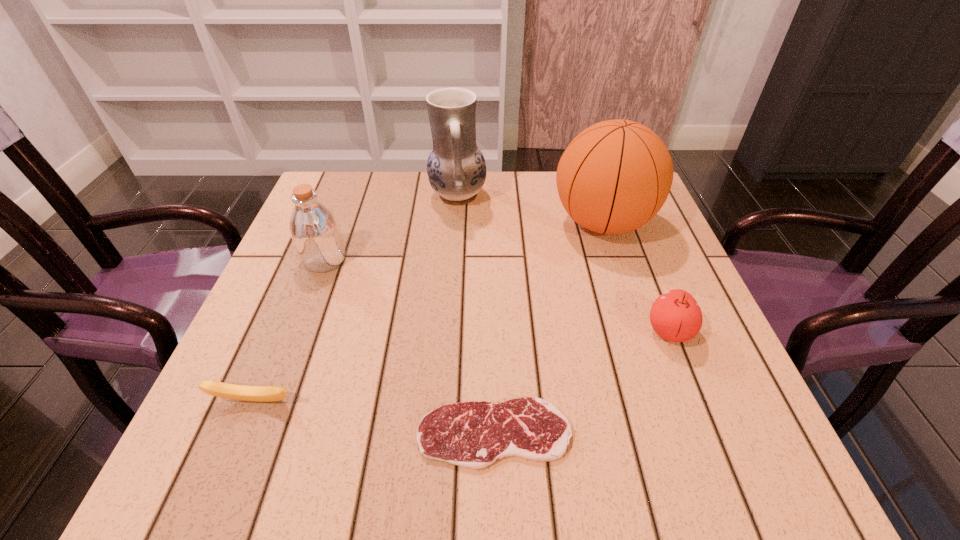
The width and height of the screenshot is (960, 540). I want to click on object situated at the far right corner, so click(x=615, y=176).

Where is `free region at the far edge of the desktop`? The image size is (960, 540). free region at the far edge of the desktop is located at coordinates (549, 213).

Locate an element on the screen. free space at the near edge is located at coordinates click(621, 469).

Locate an element on the screen. vacant area at the left edge is located at coordinates (348, 229).

In the image, there is a desktop. Identify the location of free space at the right edge. The image size is (960, 540). (723, 348).

In the image, there is a desktop. At what (x,y) coordinates should I click in order to perform the action: click on free space at the near left corner. Please return your answer as a coordinate pair (x, y). Looking at the image, I should click on (181, 468).

This screenshot has height=540, width=960. In the image, there is a desktop. In order to click on vacant space at the near right corner in this screenshot , I will do `click(774, 475)`.

The image size is (960, 540). In order to click on empty space that is in between the third shortest object and the shortest object in this screenshot , I will do `click(582, 383)`.

Where is `vacant area that lies between the basketball and the third shortest object`? vacant area that lies between the basketball and the third shortest object is located at coordinates (636, 278).

Identify the location of free space between the steak and the basketball. (548, 328).